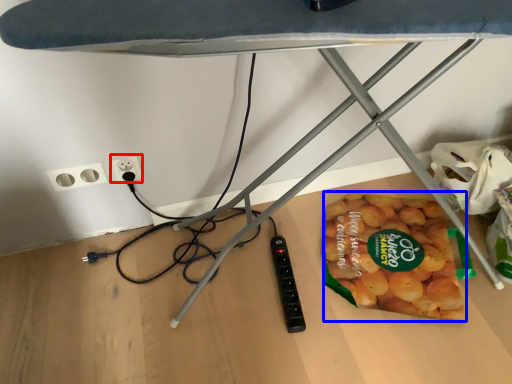
Question: Which of the following is the closest to the observer, electric outlet (highlighted by a red box) or snack (highlighted by a blue box)?

Choices:
 (A) electric outlet
 (B) snack

Answer: (B)